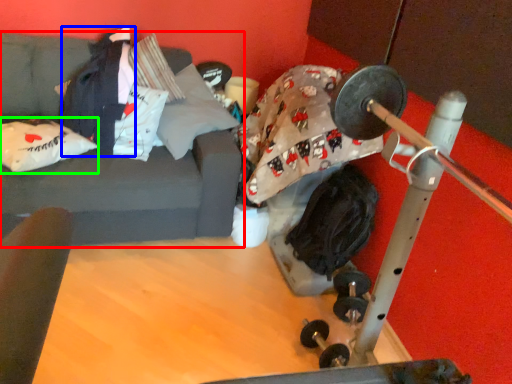
Question: Based on their relative distances, which object is farther from studio couch (highlighted by a red box)? Choose from clothing (highlighted by a blue box) and pillow (highlighted by a green box).

Choices:
 (A) clothing
 (B) pillow

Answer: (A)